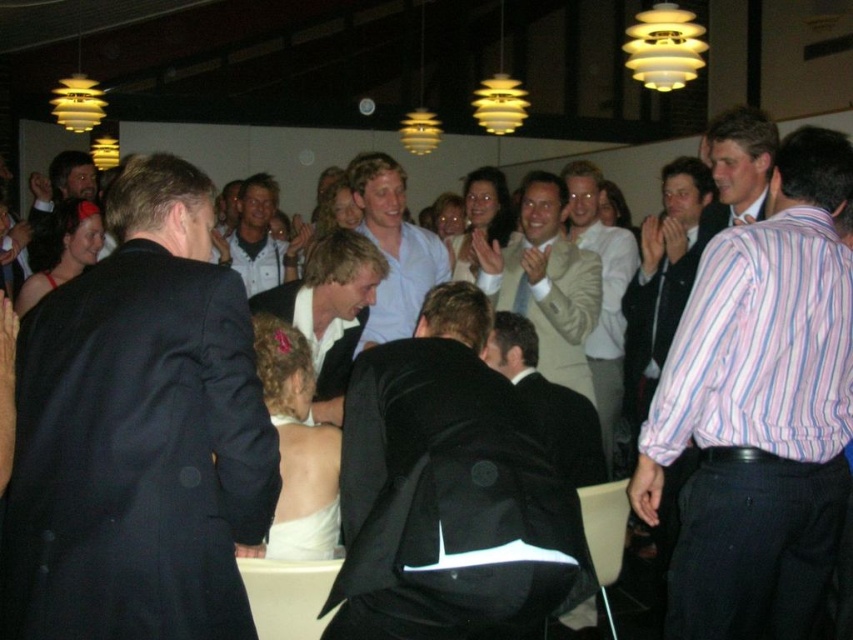
The height and width of the screenshot is (640, 853). In order to click on black suit at left in this screenshot , I will do `click(138, 433)`.

From the picture: Can you confirm if black suit at left is positioned below black leather jacket at center?

Actually, black suit at left is above black leather jacket at center.

Locate an element on the screen. black suit at left is located at coordinates (138, 433).

What do you see at coordinates (393, 248) in the screenshot? I see `light blue shirt at center` at bounding box center [393, 248].

Is light blue shirt at center shorter than light beige textured blazer at center?

Indeed, light blue shirt at center has a lesser height compared to light beige textured blazer at center.

The image size is (853, 640). I want to click on light blue shirt at center, so (x=393, y=248).

Find the location of a particular element. This screenshot has width=853, height=640. light blue shirt at center is located at coordinates (393, 248).

Which of these two, light brown suit at center or light brown leather jacket at center, stands shorter?

With less height is light brown suit at center.

Who is positioned more to the right, light brown suit at center or light brown leather jacket at center?

Positioned to the right is light brown suit at center.

Is point (358, 275) positioned in front of point (247, 196)?

Yes, it is in front of point (247, 196).

Find the location of a particular element. light brown suit at center is located at coordinates (329, 308).